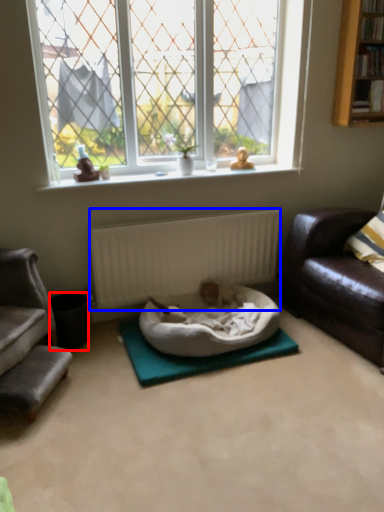
Question: Which object is further to the camera taking this photo, trash bin/can (highlighted by a red box) or radiator (highlighted by a blue box)?

Choices:
 (A) trash bin/can
 (B) radiator

Answer: (B)